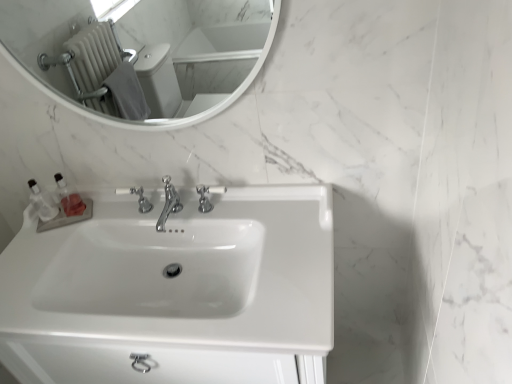
The image size is (512, 384). Describe the element at coordinates (42, 202) in the screenshot. I see `clear plastic bottles at left, the 1th toiletry from the left` at that location.

Describe the element at coordinates (138, 198) in the screenshot. I see `chrome metallic faucet at center, which is the 3th tap in right-to-left order` at that location.

Describe the element at coordinates (181, 272) in the screenshot. The height and width of the screenshot is (384, 512). I see `white glossy sink at center` at that location.

In order to face white glossy sink at center, should I rotate leftwards or rightwards?

To align with it, rotate left about 9.220°.

What do you see at coordinates (207, 196) in the screenshot? This screenshot has height=384, width=512. I see `polished chrome faucet at center, the 3th tap positioned from the left` at bounding box center [207, 196].

I want to click on clear plastic bottles at left, which is the second toiletry from left to right, so click(x=69, y=198).

At what (x,y) coordinates should I click in order to perform the action: click on the 2nd toiletry positioned above the polished chrome faucet at center, the 3th tap positioned from the left (from a real-world perspective). Please return your answer as a coordinate pair (x, y). This screenshot has height=384, width=512. Looking at the image, I should click on (42, 202).

Looking at their sizes, would you say clear plastic bottles at left, the 1th toiletry from the left, is wider or thinner than polished chrome faucet at center, the 3th tap positioned from the left?

In the image, clear plastic bottles at left, the 1th toiletry from the left, appears to be more narrow than polished chrome faucet at center, the 3th tap positioned from the left.

Would you say clear plastic bottles at left, which is the second toiletry in right-to-left order, is to the left or to the right of polished chrome faucet at center, positioned as the 1th tap in right-to-left order, in the picture?

Clearly, clear plastic bottles at left, which is the second toiletry in right-to-left order, is on the left of polished chrome faucet at center, positioned as the 1th tap in right-to-left order, in the image.

From the picture: From a real-world perspective, does chrome metallic faucet at center, which is the 3th tap in right-to-left order, stand above white glossy sink at center?

Yes, from a real-world perspective, chrome metallic faucet at center, which is the 3th tap in right-to-left order, is on top of white glossy sink at center.

Based on their sizes in the image, would you say chrome metallic faucet at center, acting as the first tap starting from the left, is bigger or smaller than white glossy sink at center?

In the image, chrome metallic faucet at center, acting as the first tap starting from the left, appears to be smaller than white glossy sink at center.

Is there a large distance between chrome metallic faucet at center, acting as the first tap starting from the left, and white glossy sink at center?

No.

Is clear plastic bottles at left, the 1th toiletry from the left, a part of polished chrome faucet at center, which appears as the second tap when viewed from the right?

Result: No, clear plastic bottles at left, the 1th toiletry from the left, is not a part of polished chrome faucet at center, which appears as the second tap when viewed from the right.

From the picture: Does polished chrome faucet at center, which appears as the second tap when viewed from the right, touch clear plastic bottles at left, the 1th toiletry from the left?

polished chrome faucet at center, which appears as the second tap when viewed from the right, is not next to clear plastic bottles at left, the 1th toiletry from the left, and they're not touching.

How different are the orientations of polished chrome faucet at center, acting as the second tap starting from the left, and clear plastic bottles at left, which is the second toiletry in right-to-left order, in degrees?

There is a 24.2-degree angle between the facing directions of polished chrome faucet at center, acting as the second tap starting from the left, and clear plastic bottles at left, which is the second toiletry in right-to-left order.

In terms of width, does polished chrome faucet at center, which appears as the second tap when viewed from the right, look wider or thinner when compared to clear plastic bottles at left, the 1th toiletry from the left?

In the image, polished chrome faucet at center, which appears as the second tap when viewed from the right, appears to be wider than clear plastic bottles at left, the 1th toiletry from the left.

Looking at this image, is polished chrome faucet at center, the 3th tap positioned from the left, facing towards white glossy sink at center?

No, polished chrome faucet at center, the 3th tap positioned from the left, is not oriented towards white glossy sink at center.

Considering the positions of objects polished chrome faucet at center, positioned as the 1th tap in right-to-left order, and white glossy sink at center in the image provided, who is behind, polished chrome faucet at center, positioned as the 1th tap in right-to-left order, or white glossy sink at center?

polished chrome faucet at center, positioned as the 1th tap in right-to-left order, is further from the camera.

Could you measure the distance between polished chrome faucet at center, positioned as the 1th tap in right-to-left order, and white glossy sink at center?

12.25 inches.

Can you tell me how much polished chrome faucet at center, the 3th tap positioned from the left, and white glossy sink at center differ in facing direction?

The facing directions of polished chrome faucet at center, the 3th tap positioned from the left, and white glossy sink at center are 0.214 degrees apart.

Is polished chrome faucet at center, acting as the second tap starting from the left, positioned beyond the bounds of white glossy sink at center?

No, polished chrome faucet at center, acting as the second tap starting from the left, is not entirely external to white glossy sink at center.

Which object is closer to the camera taking this photo, polished chrome faucet at center, which appears as the second tap when viewed from the right, or white glossy sink at center?

Positioned in front is white glossy sink at center.

Is polished chrome faucet at center, acting as the second tap starting from the left, aimed at white glossy sink at center?

No.

Is clear plastic bottles at left, which is the second toiletry in right-to-left order, looking in the opposite direction of clear plastic bottles at left, which is the second toiletry from left to right?

No, clear plastic bottles at left, which is the second toiletry in right-to-left order, is not facing away from clear plastic bottles at left, which is the second toiletry from left to right.

How different are the orientations of clear plastic bottles at left, the 1th toiletry from the left, and clear plastic bottles at left, the 1th toiletry when ordered from right to left, in degrees?

The facing directions of clear plastic bottles at left, the 1th toiletry from the left, and clear plastic bottles at left, the 1th toiletry when ordered from right to left, are 0.00555 degrees apart.

Is point (34, 183) less distant than point (72, 199)?

No.

Can you tell me how much white glossy sink at center and polished chrome faucet at center, acting as the second tap starting from the left, differ in facing direction?

0.214 degrees.

Between white glossy sink at center and polished chrome faucet at center, which appears as the second tap when viewed from the right, which one is positioned behind?

polished chrome faucet at center, which appears as the second tap when viewed from the right.

Is white glossy sink at center aimed at polished chrome faucet at center, acting as the second tap starting from the left?

No, white glossy sink at center does not turn towards polished chrome faucet at center, acting as the second tap starting from the left.

Where is `sink below the polished chrome faucet at center, which appears as the second tap when viewed from the right (from the image's perspective)`? The width and height of the screenshot is (512, 384). sink below the polished chrome faucet at center, which appears as the second tap when viewed from the right (from the image's perspective) is located at coordinates (181, 272).

Where is `the 2nd tap above the clear plastic bottles at left, the 1th toiletry from the left (from the image's perspective)`? Image resolution: width=512 pixels, height=384 pixels. the 2nd tap above the clear plastic bottles at left, the 1th toiletry from the left (from the image's perspective) is located at coordinates (207, 196).

Where is `sink lying below the chrome metallic faucet at center, which is the 3th tap in right-to-left order (from the image's perspective)`? The image size is (512, 384). sink lying below the chrome metallic faucet at center, which is the 3th tap in right-to-left order (from the image's perspective) is located at coordinates (181, 272).

Looking at the image, which one is located closer to clear plastic bottles at left, the 1th toiletry when ordered from right to left, chrome metallic faucet at center, which is the 3th tap in right-to-left order, or clear plastic bottles at left, which is the second toiletry in right-to-left order?

clear plastic bottles at left, which is the second toiletry in right-to-left order.

Consider the image. Based on their spatial positions, is polished chrome faucet at center, which appears as the second tap when viewed from the right, or clear plastic bottles at left, the 1th toiletry from the left, further from polished chrome faucet at center, positioned as the 1th tap in right-to-left order?

Based on the image, clear plastic bottles at left, the 1th toiletry from the left, appears to be further to polished chrome faucet at center, positioned as the 1th tap in right-to-left order.

Estimate the real-world distances between objects in this image. Which object is closer to clear plastic bottles at left, the 1th toiletry when ordered from right to left, polished chrome faucet at center, acting as the second tap starting from the left, or polished chrome faucet at center, positioned as the 1th tap in right-to-left order?

polished chrome faucet at center, acting as the second tap starting from the left.

Which object lies nearer to the anchor point white glossy mirror at upper center, polished chrome faucet at center, acting as the second tap starting from the left, or white glossy sink at center?

white glossy sink at center lies closer to white glossy mirror at upper center than the other object.

Considering their positions, is polished chrome faucet at center, which appears as the second tap when viewed from the right, positioned closer to chrome metallic faucet at center, which is the 3th tap in right-to-left order, than white glossy sink at center?

polished chrome faucet at center, which appears as the second tap when viewed from the right.

Based on their spatial positions, is clear plastic bottles at left, the 1th toiletry from the left, or white glossy sink at center closer to white glossy mirror at upper center?

white glossy sink at center lies closer to white glossy mirror at upper center than the other object.

From the picture: Which object lies further to the anchor point white glossy sink at center, clear plastic bottles at left, the 1th toiletry from the left, or clear plastic bottles at left, which is the second toiletry from left to right?

clear plastic bottles at left, the 1th toiletry from the left, lies further to white glossy sink at center than the other object.

Looking at the image, which one is located further to clear plastic bottles at left, the 1th toiletry when ordered from right to left, white glossy sink at center or clear plastic bottles at left, which is the second toiletry in right-to-left order?

white glossy sink at center is positioned further to the anchor clear plastic bottles at left, the 1th toiletry when ordered from right to left.

Find the location of a particular element. The width and height of the screenshot is (512, 384). toiletry between clear plastic bottles at left, which is the second toiletry from left to right, and white glossy sink at center, in the vertical direction is located at coordinates pos(42,202).

This screenshot has height=384, width=512. What are the coordinates of `mirror situated between clear plastic bottles at left, which is the second toiletry in right-to-left order, and polished chrome faucet at center, acting as the second tap starting from the left, from left to right` in the screenshot? It's located at (141, 54).

The image size is (512, 384). What are the coordinates of `toiletry between white glossy mirror at upper center and clear plastic bottles at left, the 1th toiletry when ordered from right to left, from front to back` in the screenshot? It's located at (42, 202).

The width and height of the screenshot is (512, 384). In order to click on tap between clear plastic bottles at left, which is the second toiletry in right-to-left order, and white glossy sink at center from top to bottom in this screenshot , I will do `click(168, 203)`.